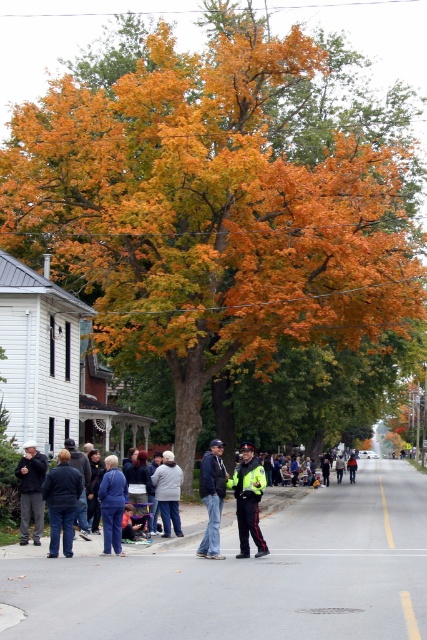
Question: Does reflective yellow jacket at center come behind dark gray jacket at left?

Choices:
 (A) no
 (B) yes

Answer: (A)

Question: Which object is farther from the camera taking this photo?

Choices:
 (A) reflective yellow jacket at center
 (B) light blue denim jacket at center
 (C) blue denim jeans at lower left

Answer: (B)

Question: Which object is the farthest from the reflective yellow jacket at center?

Choices:
 (A) light blue denim jacket at center
 (B) blue denim jeans at lower left
 (C) blue denim jacket at lower left
 (D) gray fleece jacket at center

Answer: (A)

Question: Is blue denim jeans at lower left to the right of dark gray jacket at left from the viewer's perspective?

Choices:
 (A) yes
 (B) no

Answer: (A)

Question: Among these points, which one is nearest to the camera?

Choices:
 (A) (353, 476)
 (B) (78, 492)
 (C) (248, 474)
 (D) (20, 508)

Answer: (C)

Question: Can you confirm if dark blue jeans at center is bigger than gray fleece jacket at center?

Choices:
 (A) no
 (B) yes

Answer: (A)